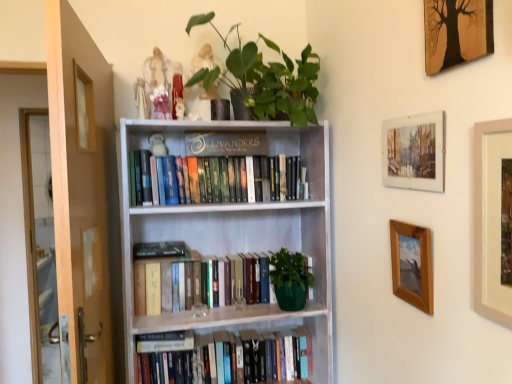
Question: Could you tell me if hardcover books at center, marked as the 2th book in a bottom-to-top arrangement, is facing hardcover books at center, the third book viewed from the top?

Choices:
 (A) no
 (B) yes

Answer: (A)

Question: Is hardcover books at center, the 2th book when ordered from top to bottom, further to the viewer compared to hardcover books at center, which appears as the 1th book when ordered from the bottom?

Choices:
 (A) no
 (B) yes

Answer: (A)

Question: Would you say hardcover books at center, the 2th book when ordered from top to bottom, contains hardcover books at center, the third book viewed from the top?

Choices:
 (A) no
 (B) yes

Answer: (A)

Question: Is hardcover books at center, marked as the 2th book in a bottom-to-top arrangement, with hardcover books at center, the third book viewed from the top?

Choices:
 (A) no
 (B) yes

Answer: (A)

Question: Considering the relative positions of hardcover books at center, the 2th book when ordered from top to bottom, and hardcover books at center, the third book viewed from the top, in the image provided, is hardcover books at center, the 2th book when ordered from top to bottom, to the right of hardcover books at center, the third book viewed from the top, from the viewer's perspective?

Choices:
 (A) yes
 (B) no

Answer: (B)

Question: Is wooden framed tree art at upper right, marked as the 1th picture frame in a top-to-bottom arrangement, situated inside hardcover books at center, the third book viewed from the top, or outside?

Choices:
 (A) inside
 (B) outside

Answer: (B)

Question: From a real-world perspective, is wooden framed tree art at upper right, which is counted as the 4th picture frame, starting from the bottom, physically located above or below hardcover books at center, which appears as the 1th book when ordered from the bottom?

Choices:
 (A) below
 (B) above

Answer: (B)

Question: Does point (487, 4) appear closer or farther from the camera than point (240, 354)?

Choices:
 (A) farther
 (B) closer

Answer: (B)

Question: In the image, is wooden framed tree art at upper right, which is counted as the 4th picture frame, starting from the bottom, positioned in front of or behind hardcover books at center, which appears as the 1th book when ordered from the bottom?

Choices:
 (A) front
 (B) behind

Answer: (A)

Question: From a real-world perspective, is green matte plant at upper center above or below watercolor paper picture frame at upper right, marked as the third picture frame in a bottom-to-top arrangement?

Choices:
 (A) above
 (B) below

Answer: (A)

Question: From the image's perspective, is green matte plant at upper center above or below watercolor paper picture frame at upper right, the second picture frame positioned from the top?

Choices:
 (A) above
 (B) below

Answer: (A)

Question: Is point (252, 91) positioned closer to the camera than point (415, 160)?

Choices:
 (A) closer
 (B) farther

Answer: (B)

Question: Considering the positions of green matte plant at upper center and watercolor paper picture frame at upper right, the second picture frame positioned from the top, in the image, is green matte plant at upper center taller or shorter than watercolor paper picture frame at upper right, the second picture frame positioned from the top,?

Choices:
 (A) tall
 (B) short

Answer: (A)

Question: Is green matte plant at upper center in front of or behind wooden framed tree art at upper right, which is counted as the 4th picture frame, starting from the bottom, in the image?

Choices:
 (A) front
 (B) behind

Answer: (B)

Question: In terms of size, does green matte plant at upper center appear bigger or smaller than wooden framed tree art at upper right, marked as the 1th picture frame in a top-to-bottom arrangement?

Choices:
 (A) small
 (B) big

Answer: (B)